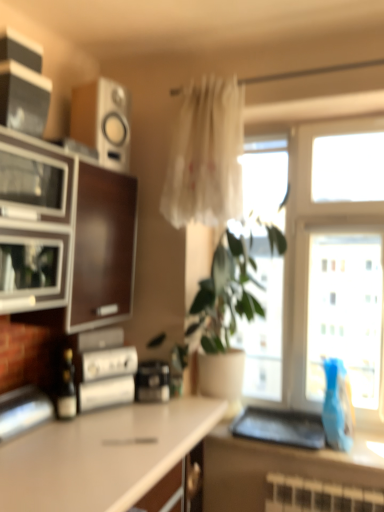
Question: Is blue glass vase at right wider or thinner than matte glass bottle at center?

Choices:
 (A) wide
 (B) thin

Answer: (A)

Question: From the image's perspective, is blue glass vase at right above or below matte glass bottle at center?

Choices:
 (A) above
 (B) below

Answer: (B)

Question: Based on their relative distances, which object is farther from the black plastic toaster at center, the second appliance from the bottom?

Choices:
 (A) matte glass bottle at center
 (B) wooden/matte speaker at upper left, the 4th appliance positioned from the bottom
 (C) brown glossy cabinet at left
 (D) matte black speaker at upper left, arranged as the 2th appliance when viewed from the top
 (E) smooth brown countertop at lower right, which ranks as the second countertop in bottom-to-top order

Answer: (D)

Question: Which is farther from the wooden/matte speaker at upper left, which ranks as the first appliance in top-to-bottom order?

Choices:
 (A) white matte countertop at lower left, the second countertop from the right
 (B) blue glass vase at right
 (C) translucent fabric curtain at center
 (D) metallic silver toaster at left, positioned as the 1th appliance in bottom-to-top order
 (E) transparent glass window at center

Answer: (B)